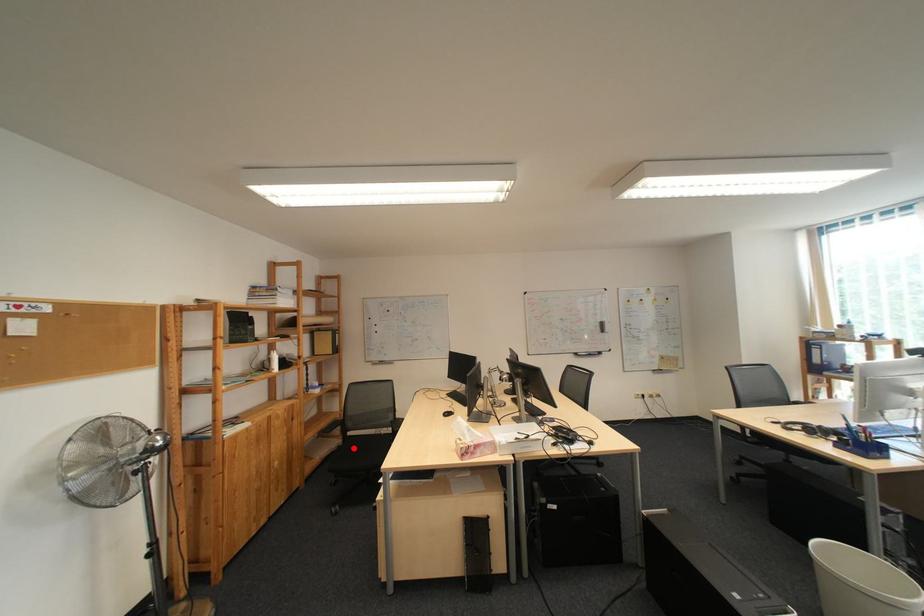
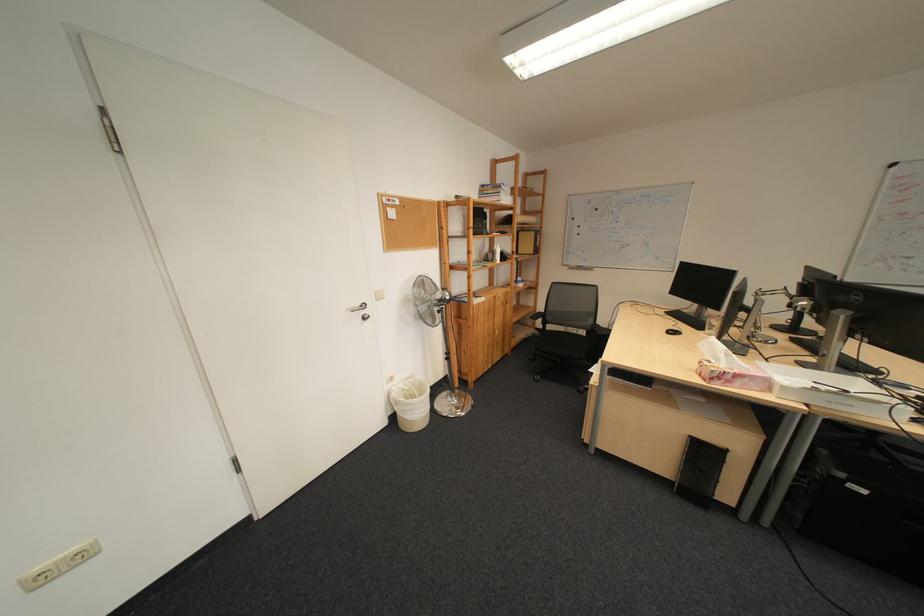
Question: I am providing you with two images of the same scene from different viewpoints. A red point is marked on the first image. At the location where the point appears in image 1, is it still visible in image 2?

Choices:
 (A) Yes
 (B) No

Answer: (A)